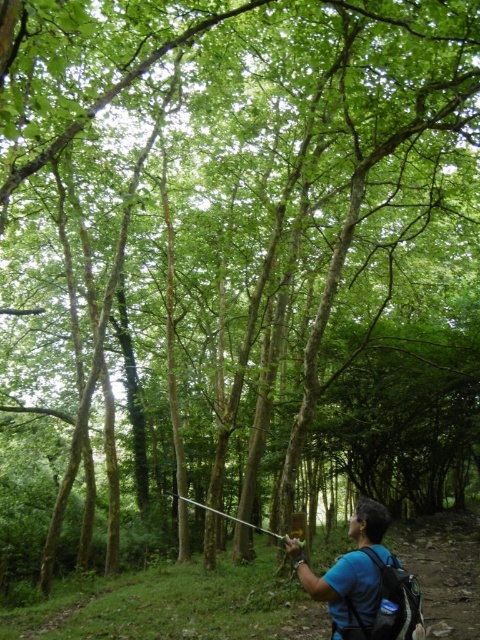
You are a hiker who just entered the forest and see the blue fabric backpack at lower right and the metallic silver fishing pole at center. Which object is nearer to you?

The blue fabric backpack at lower right is closer to the viewer than the metallic silver fishing pole at center.

Based on the photo, you are a hiker standing on the dirt path in the forest scene. You want to place your backpack on the ground near you. Is the blue fabric backpack at lower right currently positioned in a location where you can easily access it from your current position?

The blue fabric backpack at lower right is located at point (362, 580), which is near the lower right of the image. Since you are standing on the dirt path in the foreground, this position is likely within easy reach for placing or accessing the backpack.

You are a hiker who wants to carry both the blue fabric backpack at lower right and the metallic silver fishing pole at center. Since you can only carry one item, which one should you choose if you need to fit it into a narrow space?

The blue fabric backpack at lower right has a lesser width compared to the metallic silver fishing pole at center, so you should choose the blue fabric backpack at lower right to fit into the narrow space.